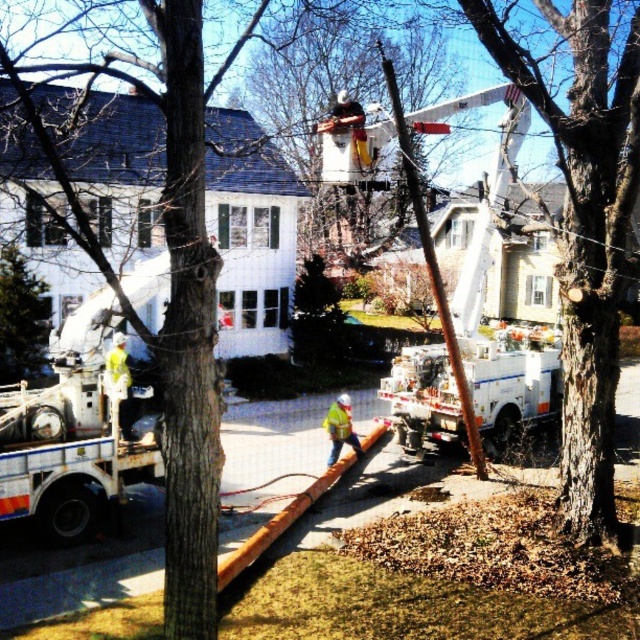
Question: Is white metallic utility truck at left thinner than yellow reflective safety vest at center?

Choices:
 (A) yes
 (B) no

Answer: (B)

Question: Can you confirm if white metallic utility truck at left is smaller than yellow reflective safety vest at center?

Choices:
 (A) no
 (B) yes

Answer: (A)

Question: Which of the following is the closest to the observer?

Choices:
 (A) yellow reflective safety vest at center
 (B) white metallic utility truck at left

Answer: (B)

Question: Which object appears closest to the camera in this image?

Choices:
 (A) white metallic utility truck at left
 (B) yellow reflective safety vest at center

Answer: (A)

Question: Does white metallic utility truck at left have a lesser width compared to yellow reflective safety vest at center?

Choices:
 (A) no
 (B) yes

Answer: (A)